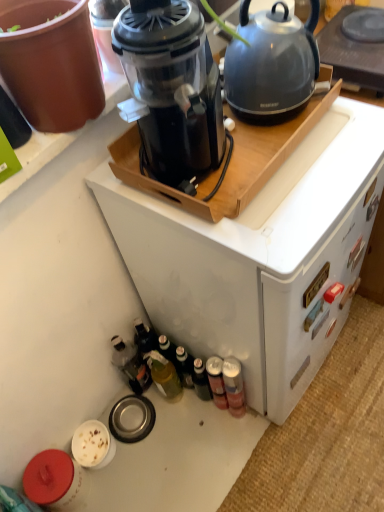
Locate an element on the screen. This screenshot has width=384, height=512. free space to the left of metallic silver can at lower right, which is the 4th bottle from left to right is located at coordinates click(x=192, y=434).